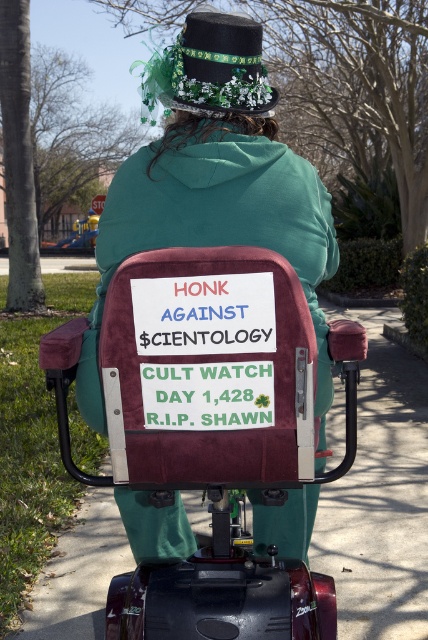
Question: Does velvety maroon scooter at center have a smaller size compared to green felt hat at upper center?

Choices:
 (A) no
 (B) yes

Answer: (A)

Question: Does velvety maroon scooter at center appear under green felt hat at upper center?

Choices:
 (A) no
 (B) yes

Answer: (B)

Question: Which point is closer to the camera taking this photo?

Choices:
 (A) (255, 45)
 (B) (118, 179)

Answer: (B)

Question: Is the position of velvety maroon scooter at center less distant than that of green felt hat at upper center?

Choices:
 (A) no
 (B) yes

Answer: (B)